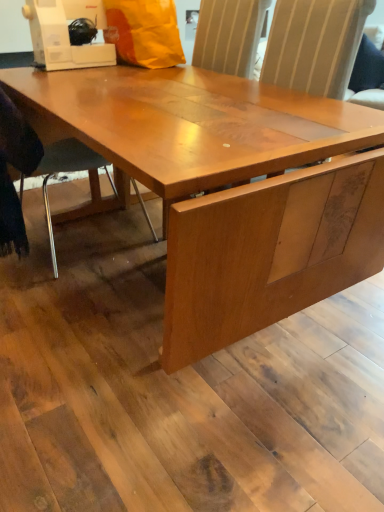
Question: Would you say orange matte paper bag at upper center is inside or outside white plastic sewing machine at upper left?

Choices:
 (A) outside
 (B) inside

Answer: (A)

Question: Considering the positions of orange matte paper bag at upper center and white plastic sewing machine at upper left in the image, is orange matte paper bag at upper center wider or thinner than white plastic sewing machine at upper left?

Choices:
 (A) thin
 (B) wide

Answer: (B)

Question: Based on their relative distances, which object is farther from the white plastic sewing machine at upper left?

Choices:
 (A) metallic gray chair at lower left
 (B) orange matte paper bag at upper center

Answer: (A)

Question: Which object is positioned farthest from the orange matte paper bag at upper center?

Choices:
 (A) white plastic sewing machine at upper left
 (B) metallic gray chair at lower left

Answer: (B)